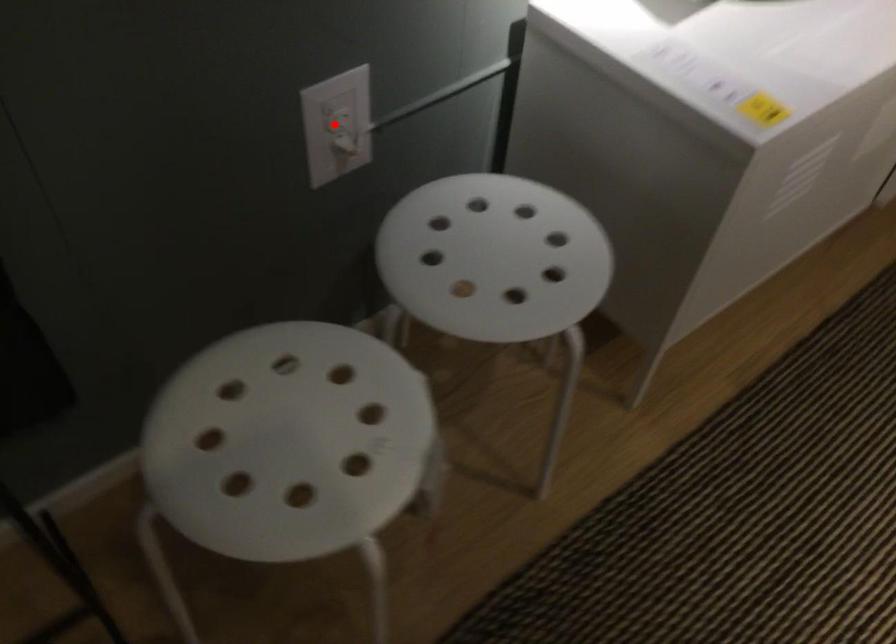
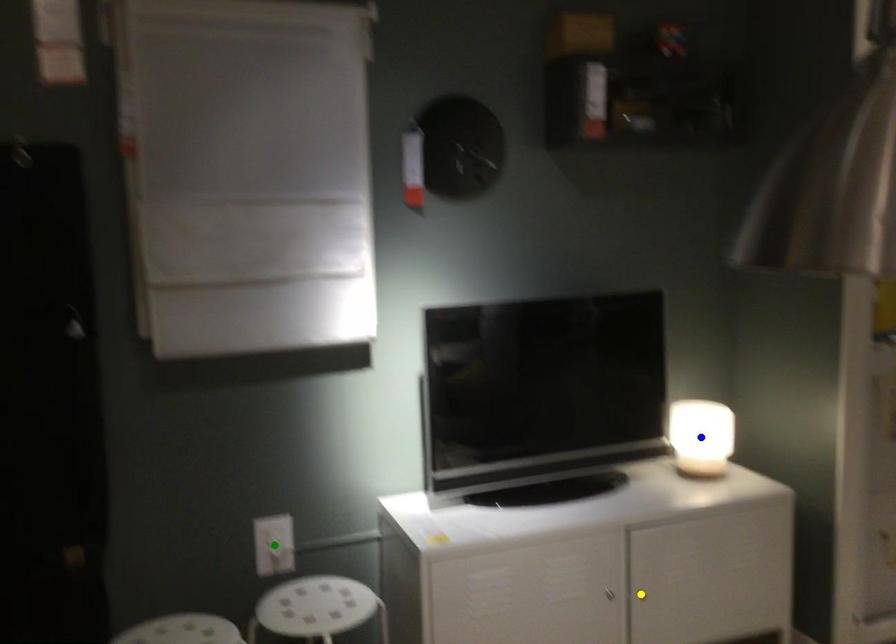
Question: I am providing you with two images of the same scene from different viewpoints. A red point is marked on the first image. You are given multiple points on the second image. Which point in image 2 represents the same 3d spot as the red point in image 1?

Choices:
 (A) blue point
 (B) green point
 (C) yellow point

Answer: (B)